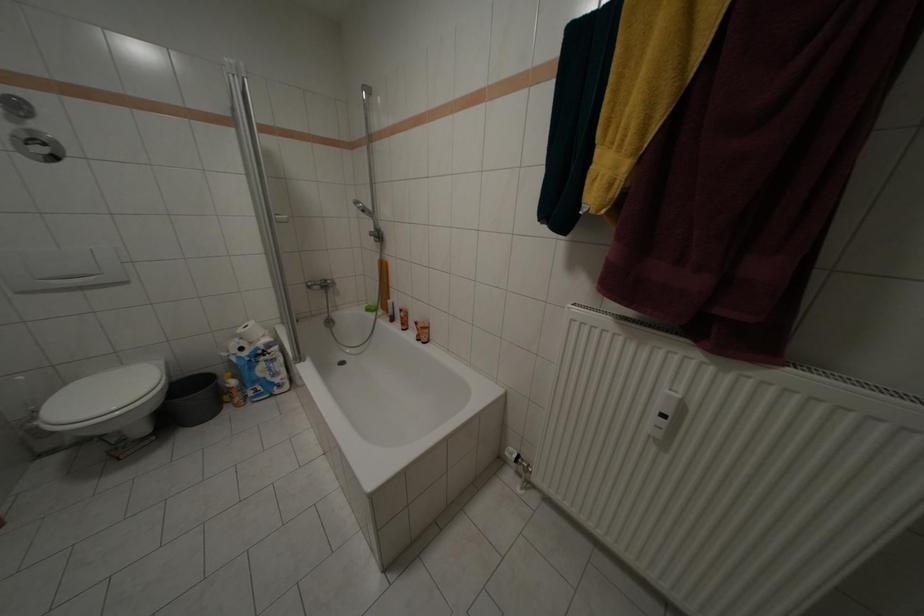
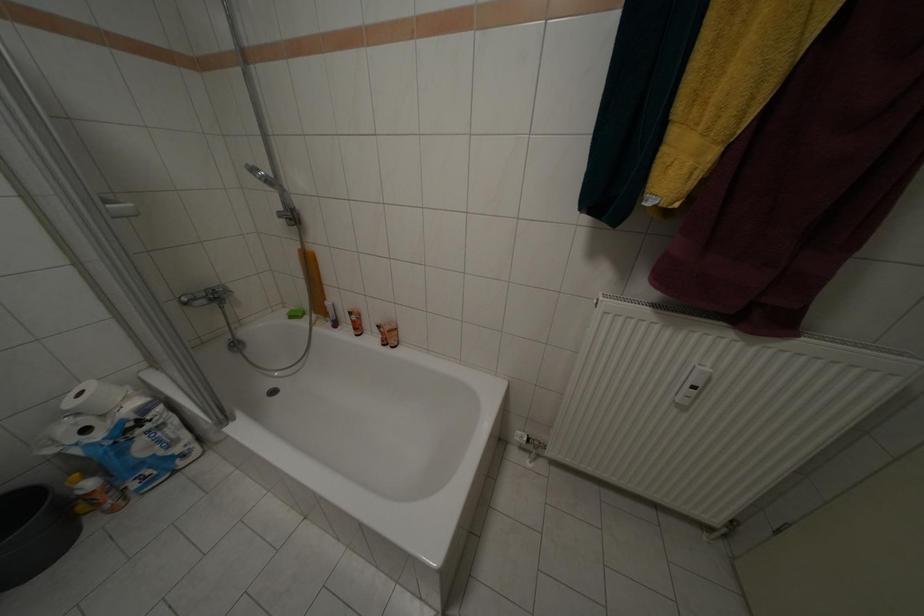
Question: The camera is either moving clockwise (left) or counter-clockwise (right) around the object. The first image is from the beginning of the video and the second image is from the end. Is the camera moving left or right when shooting the video?

Choices:
 (A) Left
 (B) Right

Answer: (A)